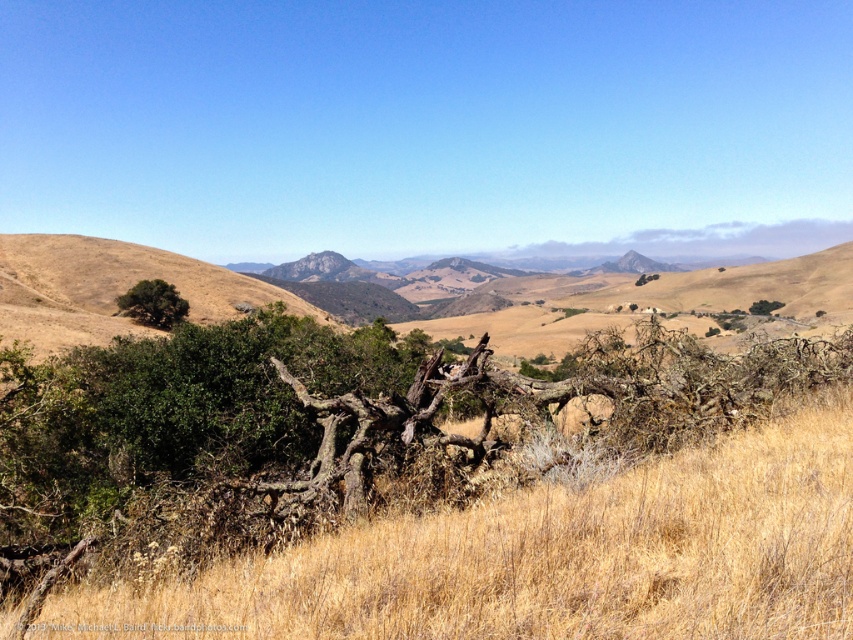
Between point (115, 298) and point (764, 310), which one is positioned behind?

Point (764, 310)

Which of these two, green leafy tree at left or green rough bark tree at center-right, stands shorter?

green rough bark tree at center-right

What are the coordinates of `green leafy tree at left` in the screenshot? It's located at (154, 304).

Does dry grass at center appear over green rough bark tree at center-right?

Incorrect, dry grass at center is not positioned above green rough bark tree at center-right.

Is point (108, 627) farther from viewer compared to point (776, 300)?

No, it is not.

The image size is (853, 640). I want to click on dry grass at center, so pos(549,557).

Consider the image. Who is higher up, dry grass at center or green leafy tree at left?

green leafy tree at left is above.

Which is in front, point (700, 611) or point (148, 317)?

Point (700, 611) is more forward.

The width and height of the screenshot is (853, 640). In order to click on dry grass at center in this screenshot , I will do `click(549, 557)`.